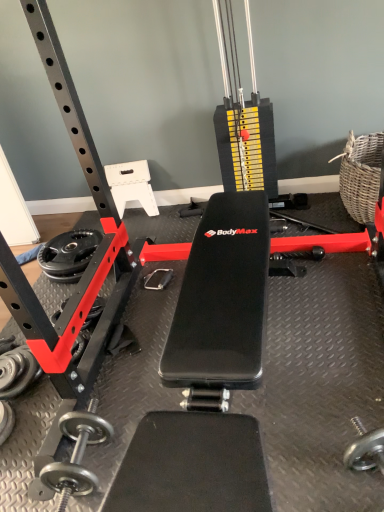
Find the location of a particular element. This screenshot has height=512, width=384. empty space that is ontop of black rubber dumbbell at lower left, which is the 2th dumbbell from bottom to top (from a real-world perspective) is located at coordinates (7, 366).